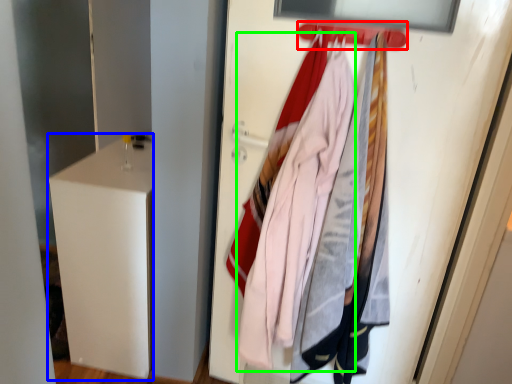
Question: Which is nearer to the hanger (highlighted by a red box)? file cabinet (highlighted by a blue box) or clothing (highlighted by a green box).

Choices:
 (A) file cabinet
 (B) clothing

Answer: (B)